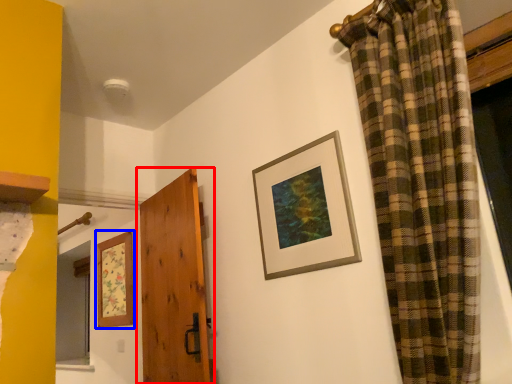
Question: Which point is further to the camera, door (highlighted by a red box) or picture frame (highlighted by a blue box)?

Choices:
 (A) door
 (B) picture frame

Answer: (B)